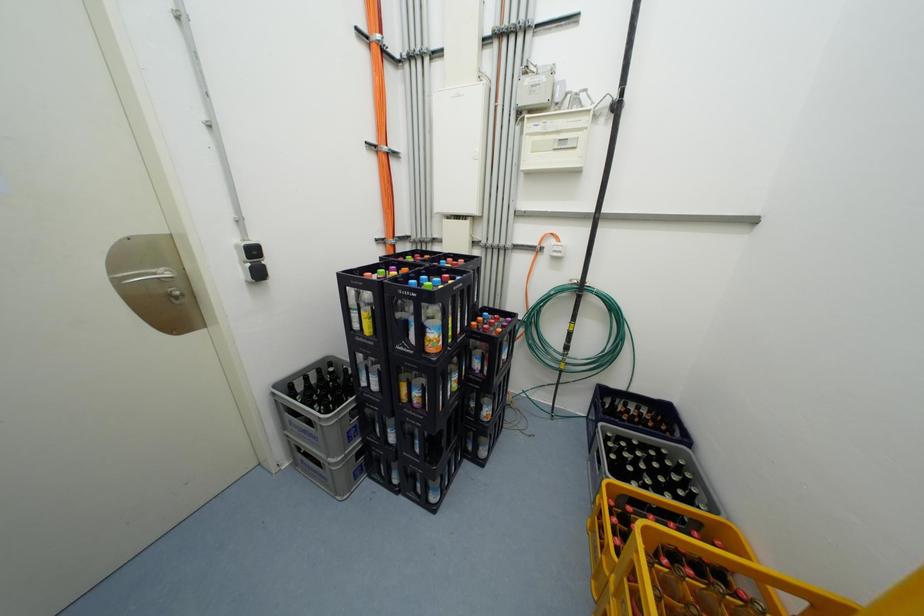
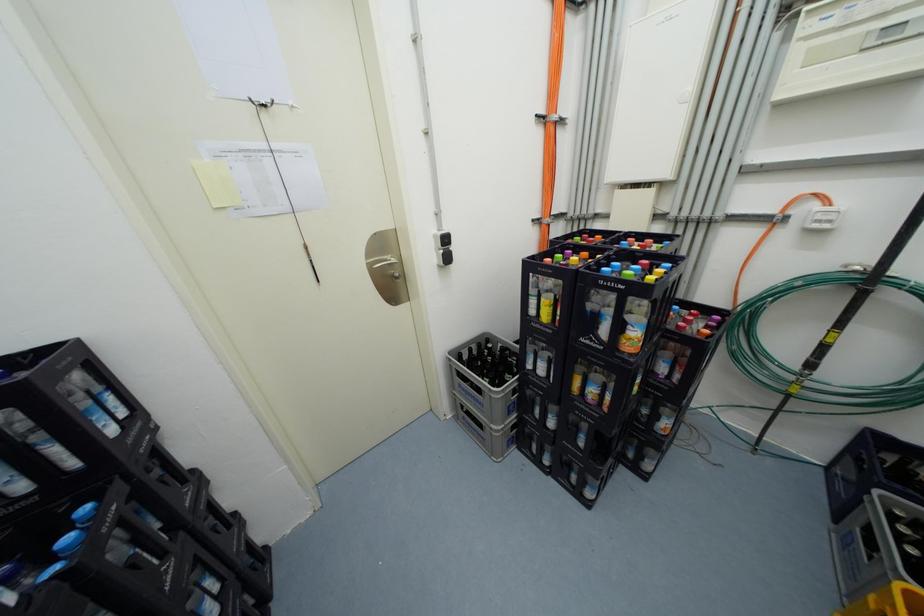
Question: In a continuous first-person perspective shot, in which direction is the camera moving?

Choices:
 (A) Left
 (B) Right
 (C) Forward
 (D) Backward

Answer: (A)